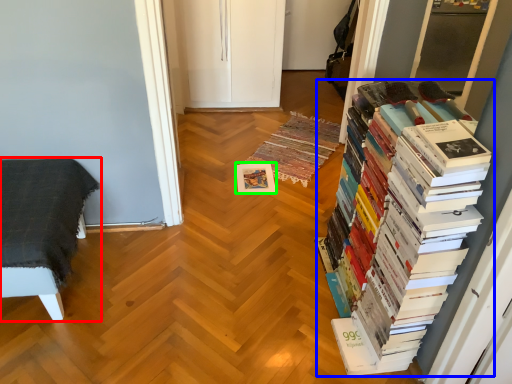
Question: Which object is the farthest from furniture (highlighted by a red box)? Choose among these: book (highlighted by a blue box) or paperback book (highlighted by a green box).

Choices:
 (A) book
 (B) paperback book

Answer: (A)